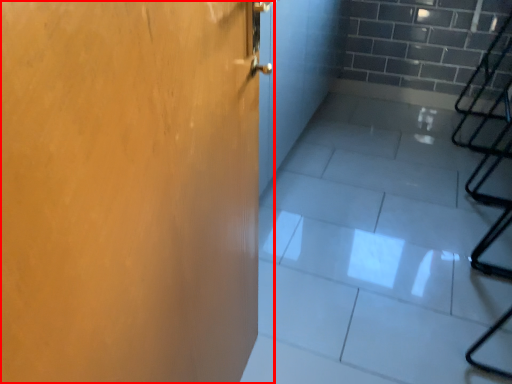
Question: From the image's perspective, considering the relative positions of door (annotated by the red box) and concrete in the image provided, where is door (annotated by the red box) located with respect to the staircase?

Choices:
 (A) above
 (B) below

Answer: (B)